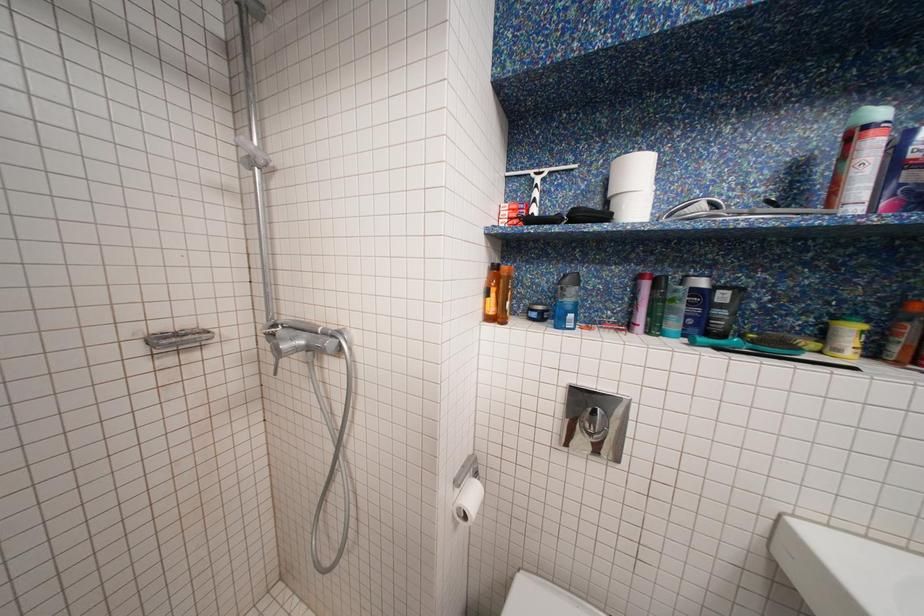
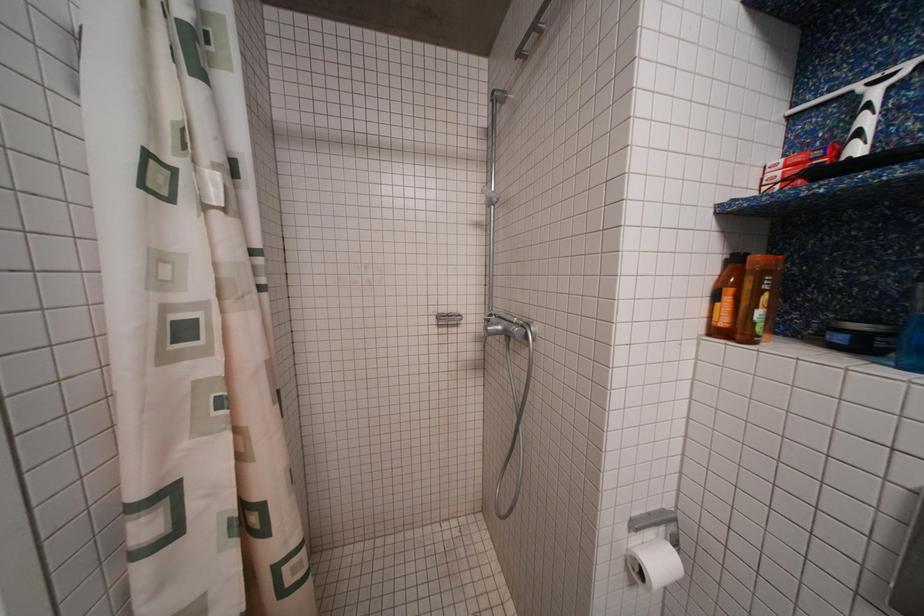
Question: The camera is either moving clockwise (left) or counter-clockwise (right) around the object. The first image is from the beginning of the video and the second image is from the end. Is the camera moving left or right when shooting the video?

Choices:
 (A) Left
 (B) Right

Answer: (B)